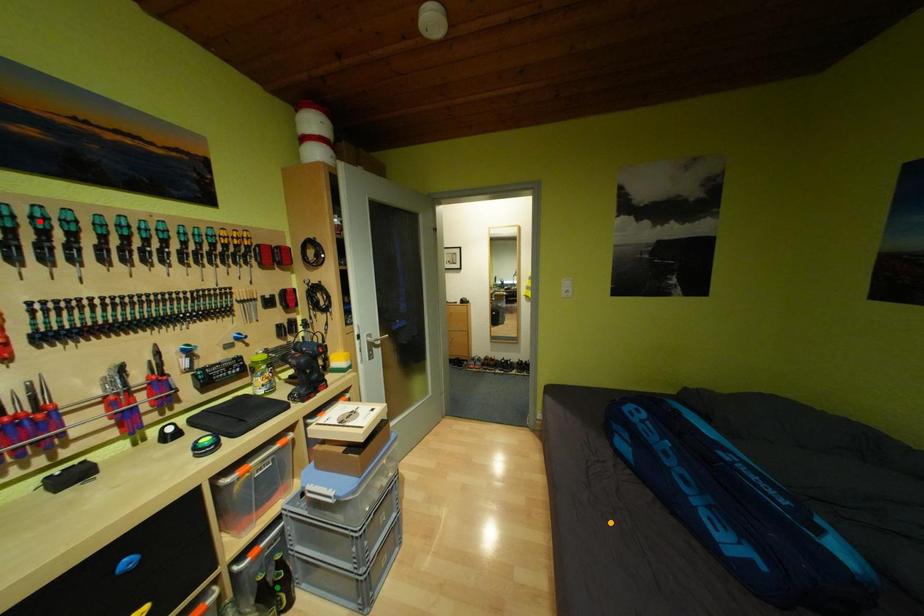
Order these from nearest to farthest:
green point, red point, orange point

1. red point
2. green point
3. orange point